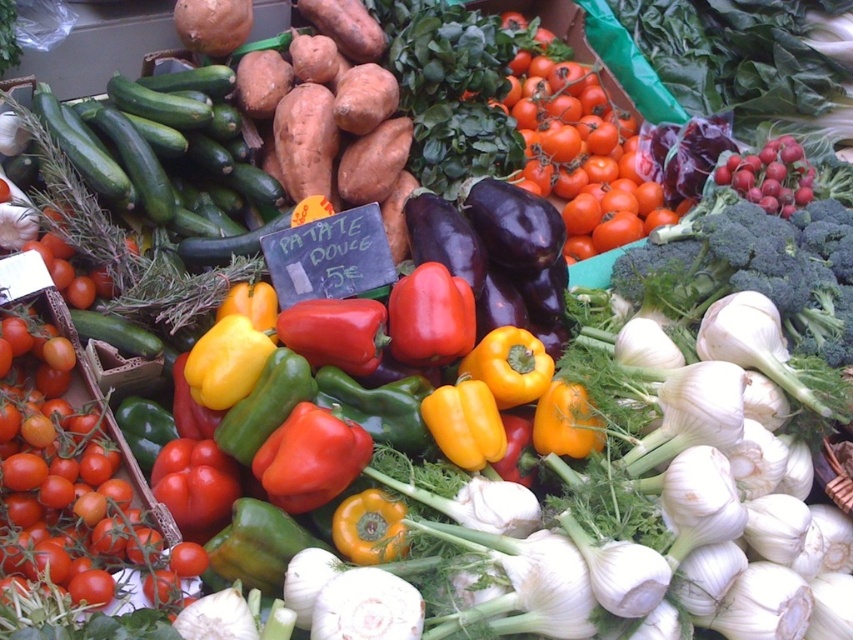
You are a GUI agent. You are given a task and a screenshot of the screen. Output one action in this format:
    pyautogui.click(x=<x>, y=<y>)
    Task: Click on the smooth red tomato at center
    The height and width of the screenshot is (640, 853).
    Given the screenshot: What is the action you would take?
    pyautogui.click(x=74, y=481)

Does smooth red tomato at center have a greater width compared to shiny red tomatoes at center?

No, smooth red tomato at center is not wider than shiny red tomatoes at center.

Who is more distant from viewer, (83, 401) or (579, 84)?

Positioned behind is point (579, 84).

Locate an element on the screen. This screenshot has width=853, height=640. smooth red tomato at center is located at coordinates (74, 481).